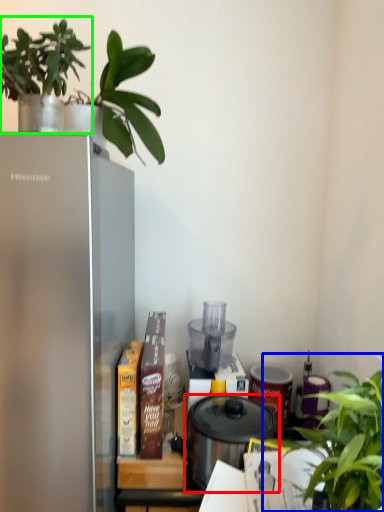
Question: Which is farther away from pressure cooker (highlighted by a red box)? houseplant (highlighted by a blue box) or houseplant (highlighted by a green box)?

Choices:
 (A) houseplant
 (B) houseplant

Answer: (B)